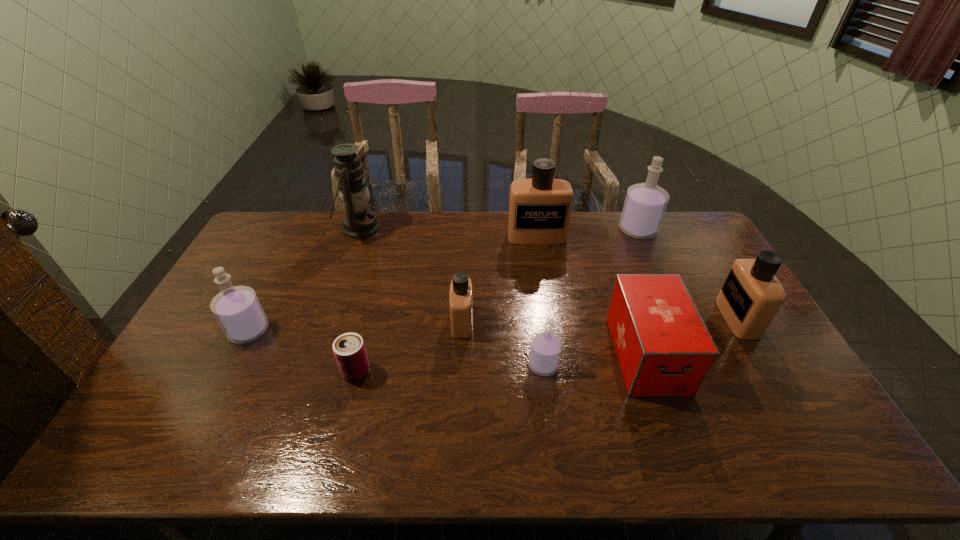
This screenshot has height=540, width=960. In order to click on empty space between the sixth object from right to left and the leftmost object in this screenshot , I will do `click(355, 326)`.

Image resolution: width=960 pixels, height=540 pixels. What are the coordinates of `vacant region between the second perfume from right to left and the leftmost object` in the screenshot? It's located at (444, 280).

Find the location of `free area in between the fifth perfume from left to right and the smallest beige perfume`. free area in between the fifth perfume from left to right and the smallest beige perfume is located at coordinates (550, 276).

The height and width of the screenshot is (540, 960). I want to click on empty space that is in between the leftmost beige perfume and the rightmost purple perfume, so click(x=550, y=276).

Choose which object is the third nearest neighbor to the rightmost object. Please provide its 2D coordinates. Your answer should be formatted as a tuple, i.e. [(x, y)], where the tuple contains the x and y coordinates of a point satisfying the conditions above.

[(540, 207)]

Where is `the closest object to the leftmost object`? the closest object to the leftmost object is located at coordinates (349, 349).

Identify the location of perfume that stands as the fourth closest to the leftmost purple perfume. The image size is (960, 540). (645, 204).

Point out which perfume is positioned as the third nearest to the shortest object. Please provide its 2D coordinates. Your answer should be formatted as a tuple, i.e. [(x, y)], where the tuple contains the x and y coordinates of a point satisfying the conditions above.

[(545, 350)]

Where is `beige perfume that stands as the closest to the rightmost beige perfume`? beige perfume that stands as the closest to the rightmost beige perfume is located at coordinates (540, 207).

The width and height of the screenshot is (960, 540). I want to click on beige perfume that is the closest to the rightmost beige perfume, so click(540, 207).